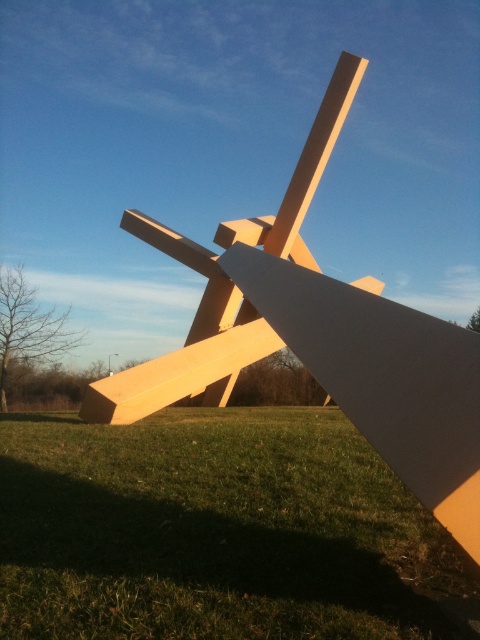
From the picture: You are standing at the origin point in the image. Which direction should you move to reach the green grass at lower center?

The green grass at lower center is located at coordinates approximately 0.831 on the x axis and 0.454 on the y axis. Since you are at the origin, you should move towards the positive x and positive y direction to reach it.

You are standing in front of the sculpture and want to step onto the green grass at lower center. Is the matte wood cross at center blocking your path?

The green grass at lower center is further to the viewer than the matte wood cross at center, meaning the matte wood cross at center is closer to you. Therefore, the matte wood cross at center would block your path to the green grass at lower center.

You are an artist planning to paint this sculpture. You want to highlight the contrast between the green grass at lower center and the matte wood cross at center. Which object should you focus on to emphasize the difference in thickness?

The green grass at lower center is thinner than the matte wood cross at center, so focusing on the green grass at lower center will emphasize the contrast in thickness between the two objects.